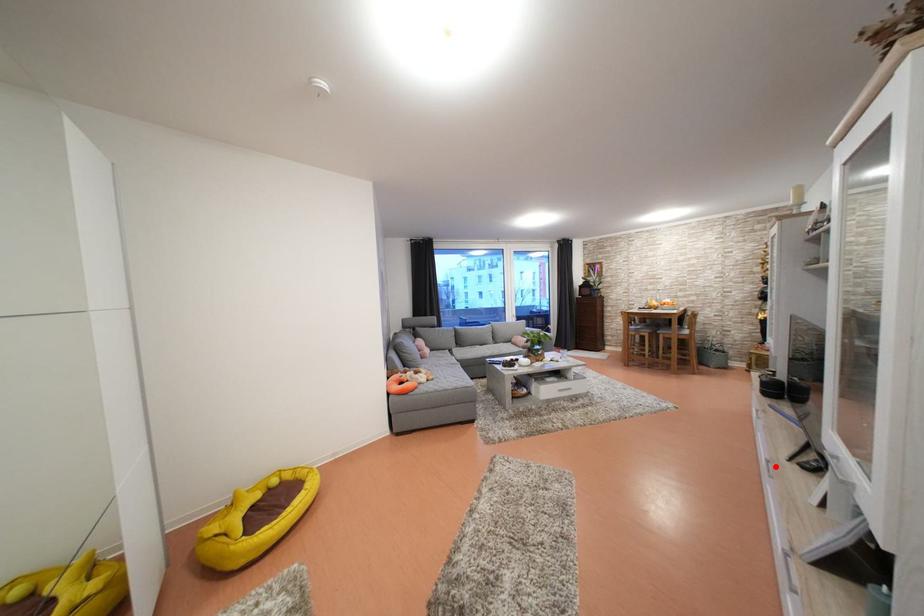
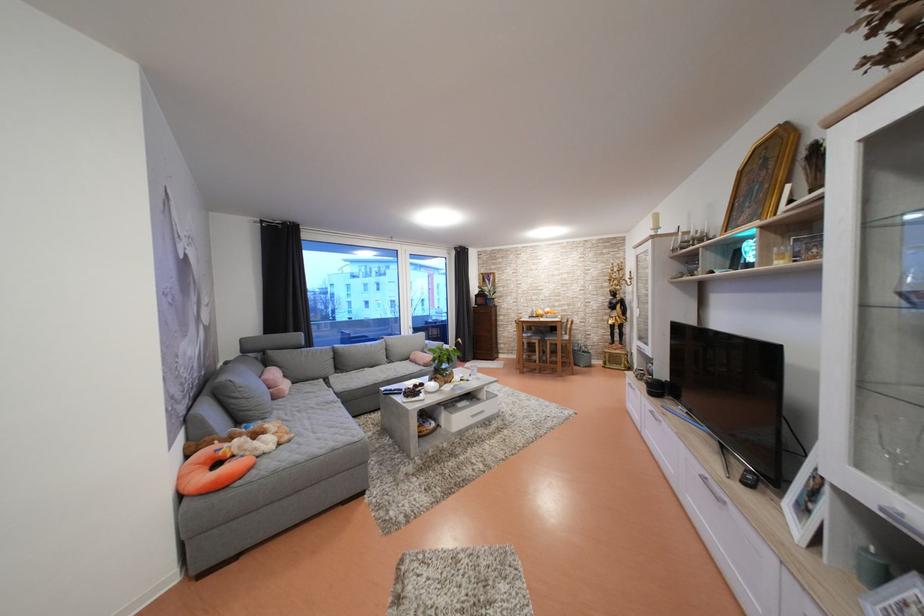
Question: I am providing you with two images of the same scene from different viewpoints. Image1 has a red point marked. In image2, the corresponding 3D location appears at what relative position? Reply with the corresponding letter.

Choices:
 (A) Closer
 (B) Farther

Answer: (A)